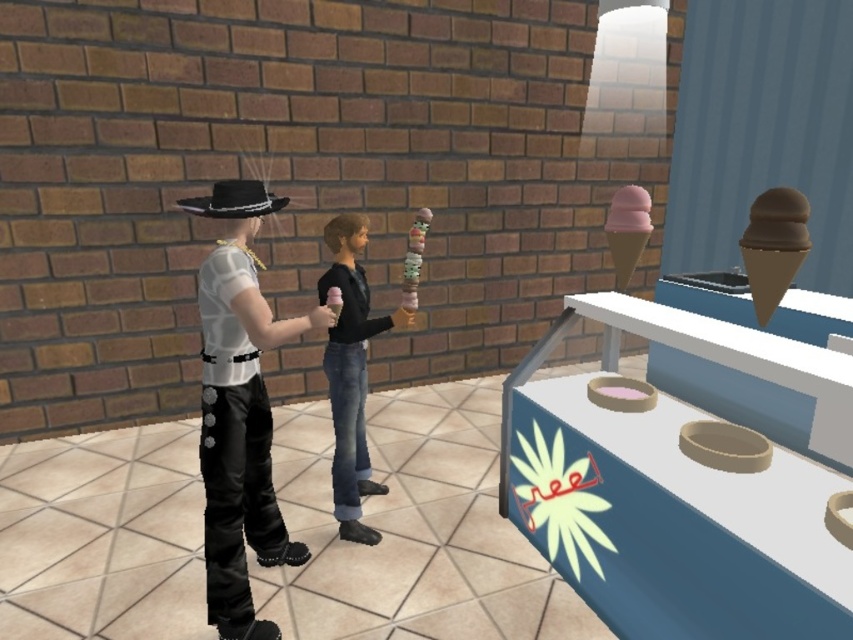
You are a food vendor at the ice cream stand and need to place both the multicolored candy at center and the pink matte ice cream cone at center on a shelf. Which item should you place first if you want to maximize shelf space efficiency?

The multicolored candy at center is wider than the pink matte ice cream cone at center, so you should place the multicolored candy at center first to make better use of the shelf space.

You are a customer at the ice cream stand and want to choose between the pink matte ice cream cone at upper right and the multicolored candy at center. Which one is taller?

The multicolored candy at center is taller than the pink matte ice cream cone at upper right.

You are a delivery robot that needs to transport a package from the pink matte ice cream cone at upper right to the multicolored candy at center. Given that your maximum carrying distance is 5 feet, will you be able to complete the delivery without needing to recharge?

The distance between the pink matte ice cream cone at upper right and the multicolored candy at center is 4.68 feet, which is within your 5 feet maximum carrying distance. Therefore, you can complete the delivery without needing to recharge.